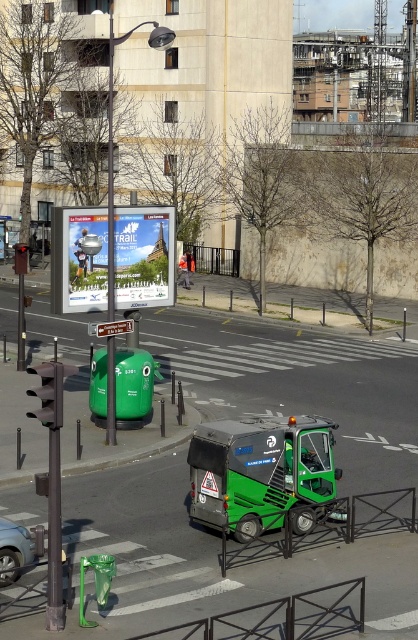
You are a delivery person who needs to park your 2.5 meter wide metallic silver car at lower left as close as possible to the matte white poster at center without blocking the pedestrian crossing. Can you park the car within 10 meters of the poster?

The matte white poster at center is 9.95 meters from metallic silver car at lower left. Since 9.95 meters is just under 10 meters, you can park the metallic silver car at lower left within 10 meters of the matte white poster at center without blocking the pedestrian crossing.

You are a delivery person who needs to place a new matte white poster at center on the urban street scene. According to the scene description, where should you place it?

The matte white poster at center should be placed at point (143, 257) as indicated in the scene description.

Consider the image. You are a delivery person who needs to park your 5.5 meter long van between the green matte garbage truck at center and the matte white poster at center. Is there enough space between them for your van?

The distance between the green matte garbage truck at center and the matte white poster at center is 8.01 meters, which is more than the van length of 5.5 meters. Yes, there is enough space.